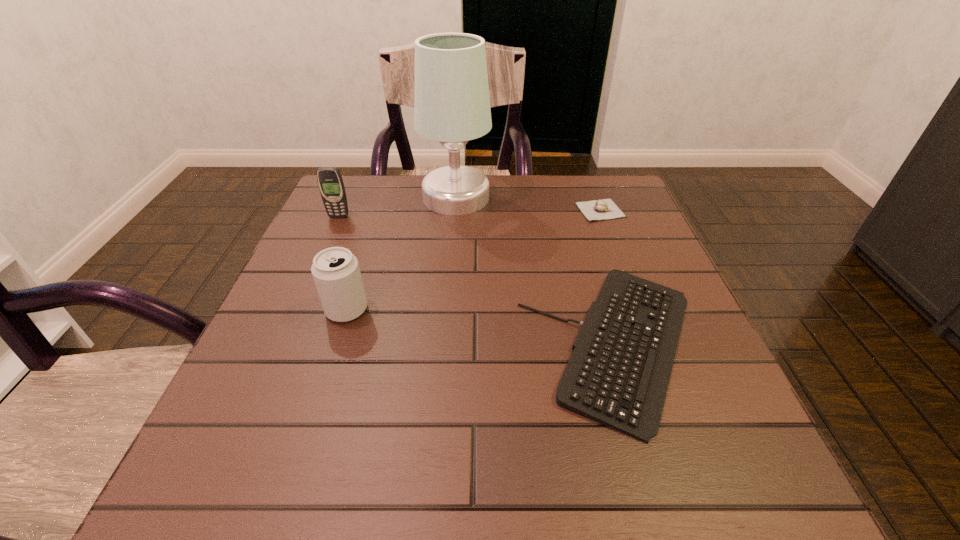
What are the coordinates of `vacant space that satisfies the following two spatial constraints: 1. on the base of the third object from right to left; 2. on the screen of the cellular telephone` in the screenshot? It's located at (454, 217).

Where is `vacant area in the image that satisfies the following two spatial constraints: 1. on the screen of the cellular telephone; 2. on the right side of the fourth object from right to left`? Image resolution: width=960 pixels, height=540 pixels. vacant area in the image that satisfies the following two spatial constraints: 1. on the screen of the cellular telephone; 2. on the right side of the fourth object from right to left is located at coordinates (299, 310).

Where is `free space that satisfies the following two spatial constraints: 1. on the screen of the can; 2. on the right side of the leftmost object`? The image size is (960, 540). free space that satisfies the following two spatial constraints: 1. on the screen of the can; 2. on the right side of the leftmost object is located at coordinates (299, 310).